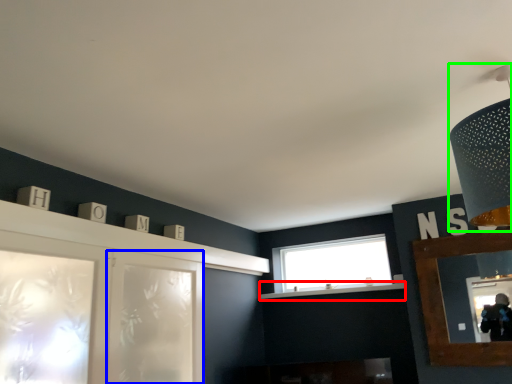
Question: Which object is positioned closest to mantle (highlighted by a red box)? Select from screen door (highlighted by a blue box) and light fixture (highlighted by a green box).

Choices:
 (A) screen door
 (B) light fixture

Answer: (A)